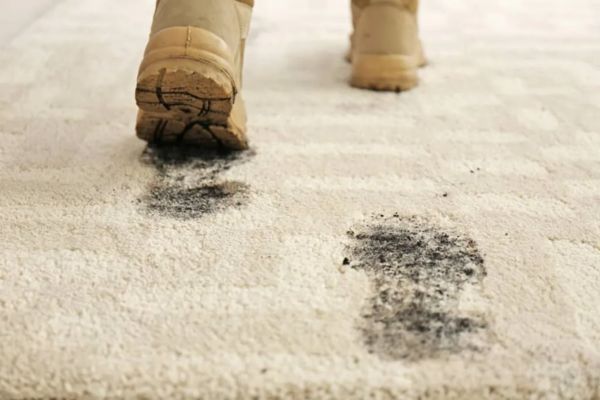
Identify the location of muddy footprint. This screenshot has width=600, height=400. (195, 196), (435, 280).